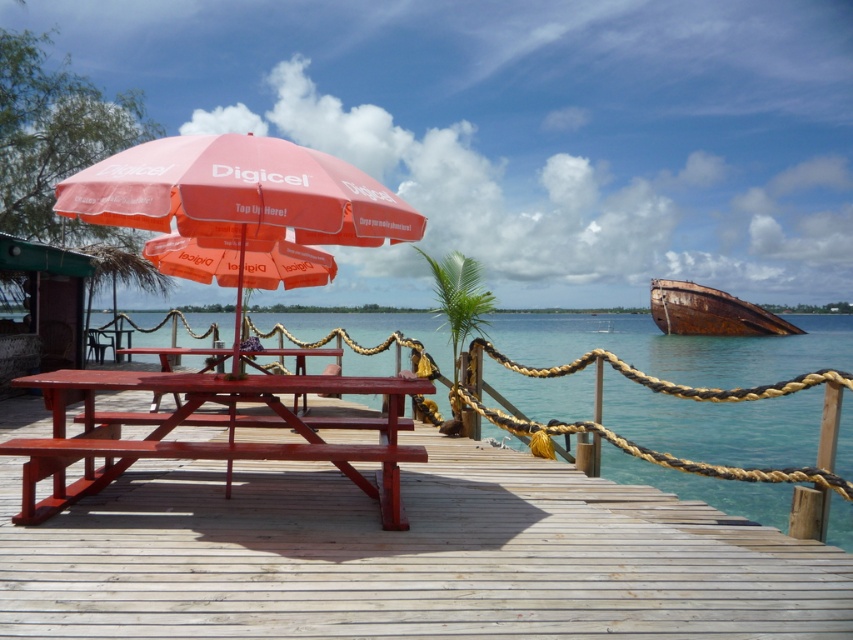
You are planning to install a new lighting system on the wooden pier. The lighting fixtures require a minimum height clearance of 2 meters. Based on the scene, which object between the orange fabric umbrella at center and the rusty metal boat at right would allow you to safely install the lighting without obstruction?

The orange fabric umbrella at center has a greater height compared to the rusty metal boat at right. Since the lighting fixtures require a minimum height clearance of 2 meters, you should install them above the orange fabric umbrella at center as it is taller and would provide sufficient clearance.

You are planning to set up a small event on the waterfront pier. You have both a matte red picnic table at center and a smooth wood table at center available. Which table should you choose if you need more seating space for guests?

The matte red picnic table at center is larger in size than the smooth wood table at center, so you should choose the matte red picnic table at center for more seating space.

You are standing at the point marked by the coordinates point (241, 262). What object are you standing on?

You are standing on the orange fabric umbrella at center marked by point (241, 262).